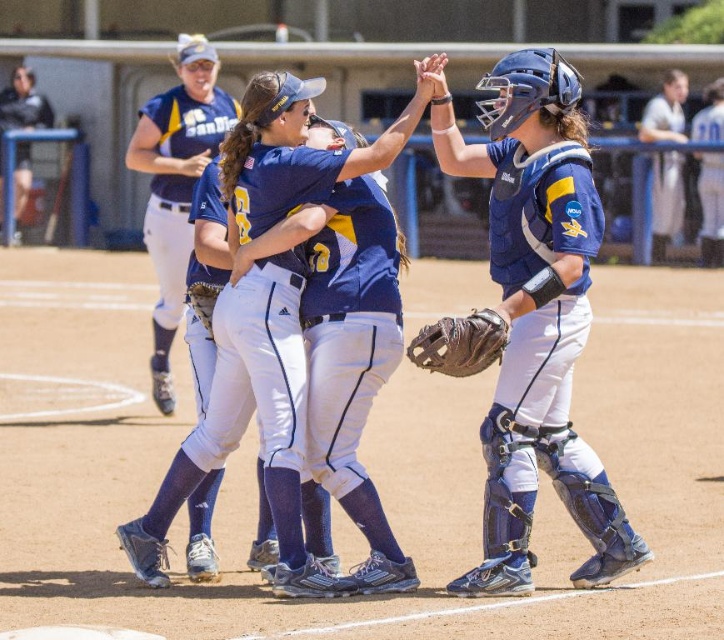
You are a photographer standing behind the players. You want to take a photo that includes both the matte blue jersey at center and the brown leather glove at lower center. Which object will appear larger in your photo?

The matte blue jersey at center will appear larger in the photo because it is closer to the viewer than the brown leather glove at lower center.

You are a photographer standing at the edge of the softball field. You want to take a photo of the matte blue jersey at center. If your camera has a maximum focus range of 25 feet, will you be able to capture the jersey clearly?

The matte blue jersey at center is 24.80 feet away from the viewer. Since the camera can focus up to 25 feet, it is within range, so yes, the jersey can be captured clearly.